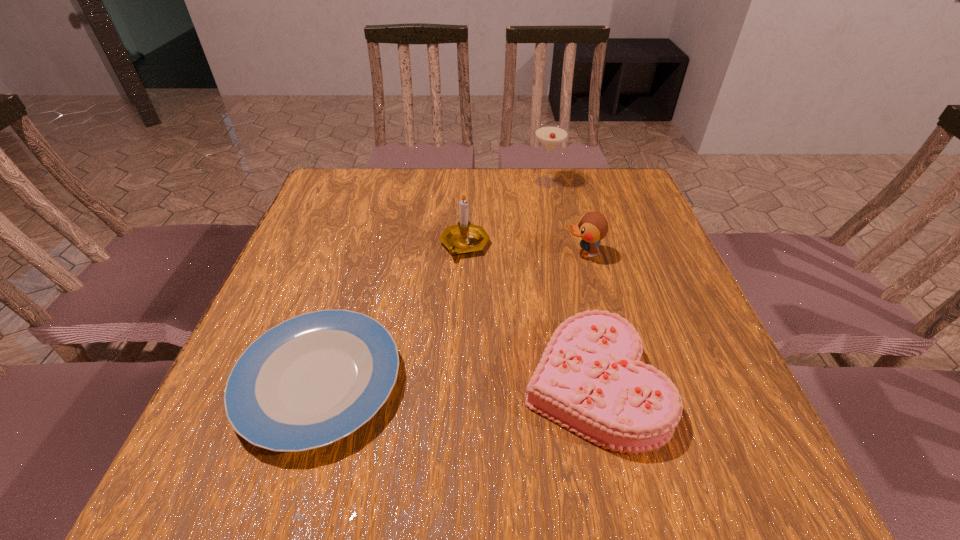
Locate an element on the screen. object that is at the near right corner is located at coordinates (590, 379).

Identify the location of free space at the far edge. This screenshot has width=960, height=540. (427, 192).

Locate an element on the screen. The image size is (960, 540). free space at the near edge of the desktop is located at coordinates (546, 462).

This screenshot has width=960, height=540. I want to click on free space at the left edge of the desktop, so tap(348, 219).

At what (x,y) coordinates should I click in order to perform the action: click on vacant space at the right edge of the desktop. Please return your answer as a coordinate pair (x, y). This screenshot has width=960, height=540. Looking at the image, I should click on (657, 230).

At what (x,y) coordinates should I click in order to perform the action: click on vacant region at the far left corner of the desktop. Please return your answer as a coordinate pair (x, y). Looking at the image, I should click on (368, 190).

The width and height of the screenshot is (960, 540). In the image, there is a desktop. Find the location of `vacant space at the far right corner`. vacant space at the far right corner is located at coordinates (638, 192).

This screenshot has width=960, height=540. I want to click on vacant area that lies between the shortest object and the third tallest object, so click(x=451, y=318).

I want to click on free area in between the duck and the second object from left to right, so click(524, 249).

The height and width of the screenshot is (540, 960). Identify the location of free space between the duck and the farthest object. (564, 218).